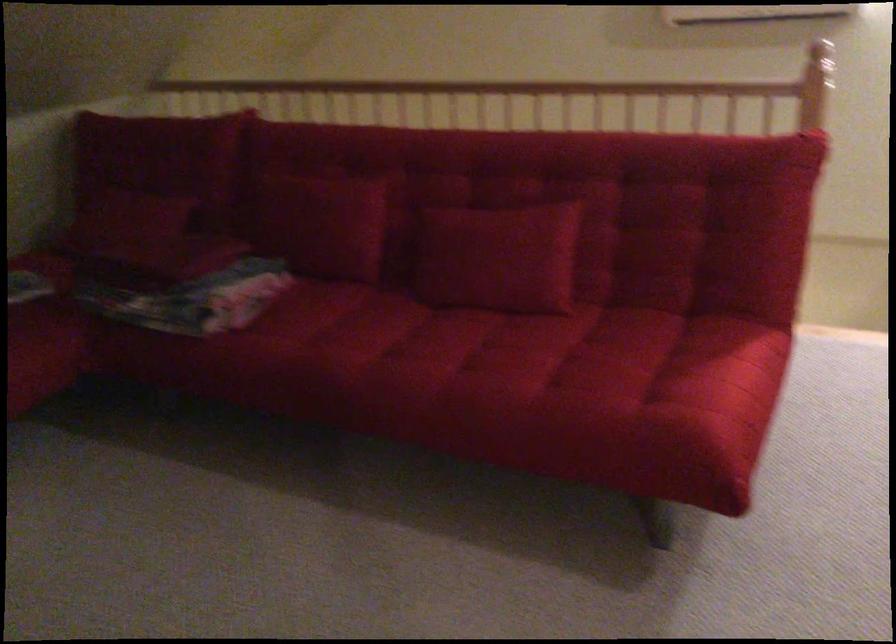
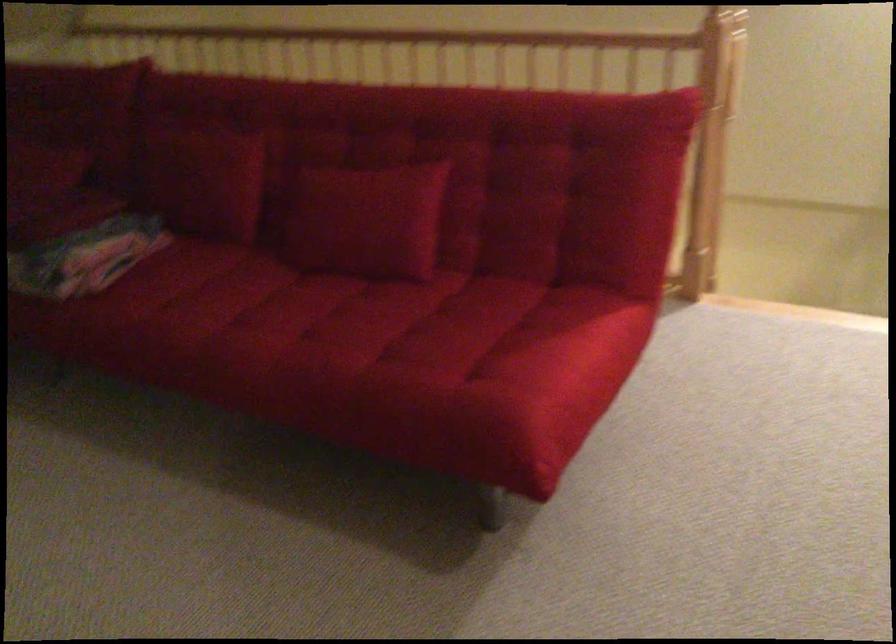
Find the pixel in the second image that matches point (435, 339) in the first image.

(290, 310)